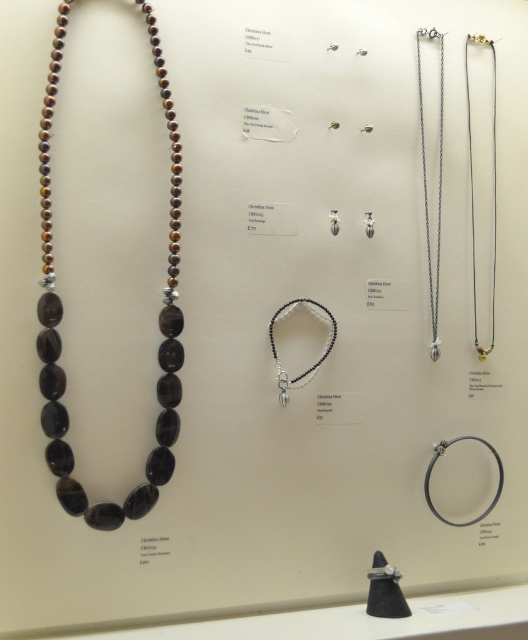
Which of these two, silver metallic chain at right or silver metallic chain at upper right, stands taller?

With more height is silver metallic chain at upper right.

Between silver metallic chain at right and silver metallic chain at upper right, which one appears on the left side from the viewer's perspective?

silver metallic chain at upper right

Does point (494, 232) come behind point (422, 168)?

Yes.

Find the location of `silver metallic chain at right`. silver metallic chain at right is located at coordinates click(x=473, y=193).

Does brown polished stone necklace at left have a lesser width compared to black beaded bracelet at center?

Incorrect, brown polished stone necklace at left's width is not less than black beaded bracelet at center's.

Who is shorter, brown polished stone necklace at left or black beaded bracelet at center?

black beaded bracelet at center

This screenshot has width=528, height=640. What do you see at coordinates (61, 317) in the screenshot? I see `brown polished stone necklace at left` at bounding box center [61, 317].

Identify the location of brown polished stone necklace at left. This screenshot has height=640, width=528. (61, 317).

Is the position of brown polished stone necklace at left less distant than that of silver metallic chain at right?

Yes, brown polished stone necklace at left is closer to the viewer.

Is brown polished stone necklace at left above silver metallic chain at right?

No, brown polished stone necklace at left is not above silver metallic chain at right.

Between point (178, 259) and point (485, 348), which one is positioned in front?

Positioned in front is point (178, 259).

You are a GUI agent. You are given a task and a screenshot of the screen. Output one action in this format:
    pyautogui.click(x=<x>, y=<y>)
    Task: Click on the brown polished stone necklace at left
    The width and height of the screenshot is (528, 640).
    Given the screenshot: What is the action you would take?
    pyautogui.click(x=61, y=317)